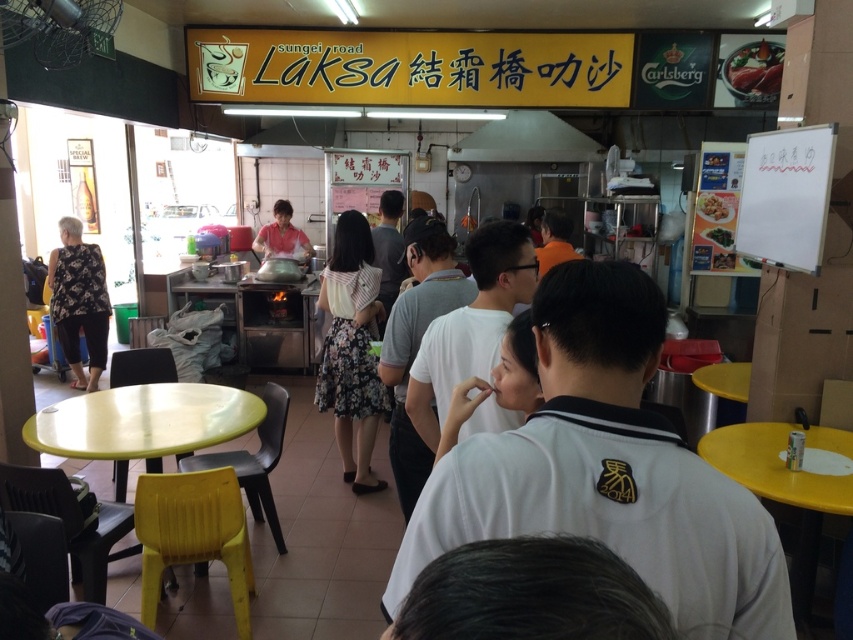
You are standing at the entrance of the food stall and want to reach both the point at coordinate (x=810, y=554) and the point at (x=265, y=253). Which point will you reach first?

The point at coordinate (x=810, y=554) will be reached first because it is closer to the viewer compared to the point at (x=265, y=253).

You are a food stall worker wearing a white shirt at center and need to place a white glossy bowl at center on the counter. Can you determine if the bowl will fit within the width of your shirt?

The white shirt at center is wider than the white glossy bowl at center, so the bowl will fit within the shirt width.